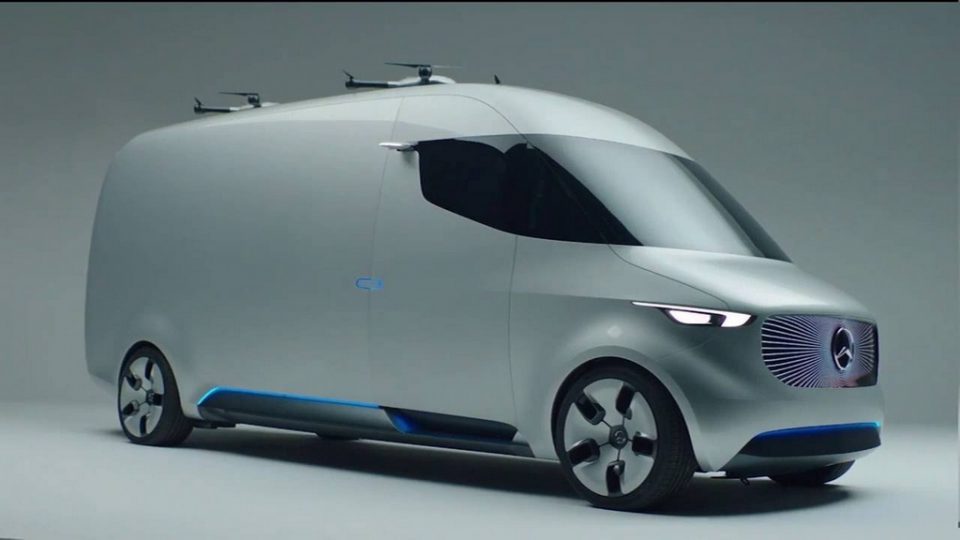
Where is `wall`? The image size is (960, 540). wall is located at coordinates (851, 100).